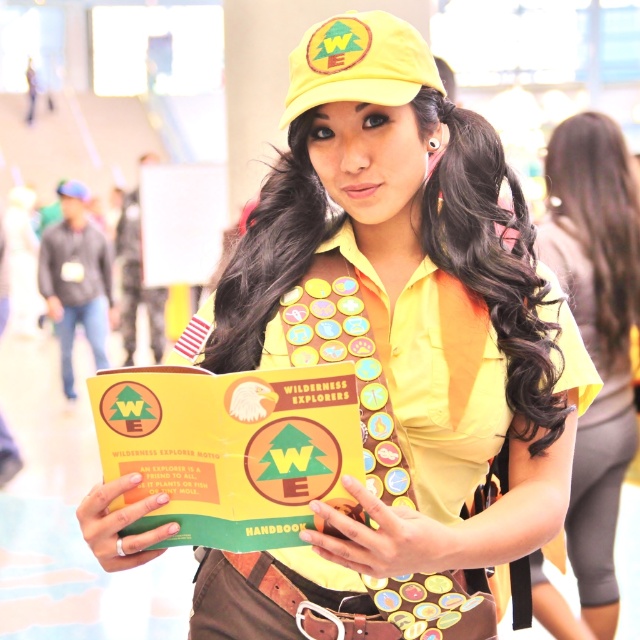
Question: Can you confirm if yellow matte shirt at center is wider than yellow fabric cap at upper center?

Choices:
 (A) no
 (B) yes

Answer: (B)

Question: Where is yellow matte handbook at center located in relation to yellow fabric hat at upper center in the image?

Choices:
 (A) above
 (B) below

Answer: (B)

Question: Which point is closer to the camera taking this photo?

Choices:
 (A) (340, 49)
 (B) (77, 195)

Answer: (A)

Question: Which of the following is the closest to the observer?

Choices:
 (A) yellow matte handbook at center
 (B) yellow matte shirt at center

Answer: (A)

Question: Considering the relative positions of yellow matte handbook at center and yellow matte shirt at center in the image provided, where is yellow matte handbook at center located with respect to yellow matte shirt at center?

Choices:
 (A) below
 (B) above

Answer: (B)

Question: Which of the following is the closest to the observer?

Choices:
 (A) yellow matte shirt at center
 (B) yellow fabric hat at upper center

Answer: (A)